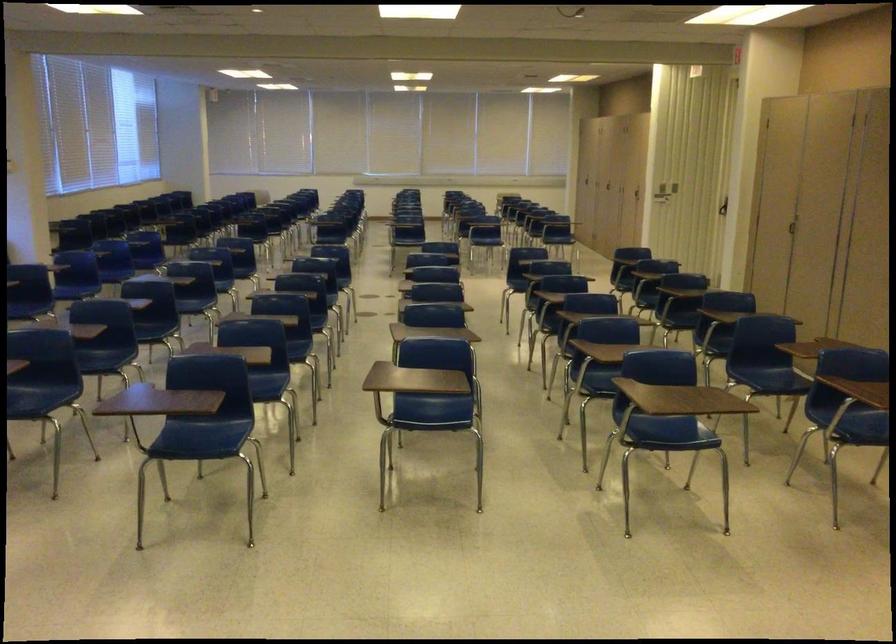
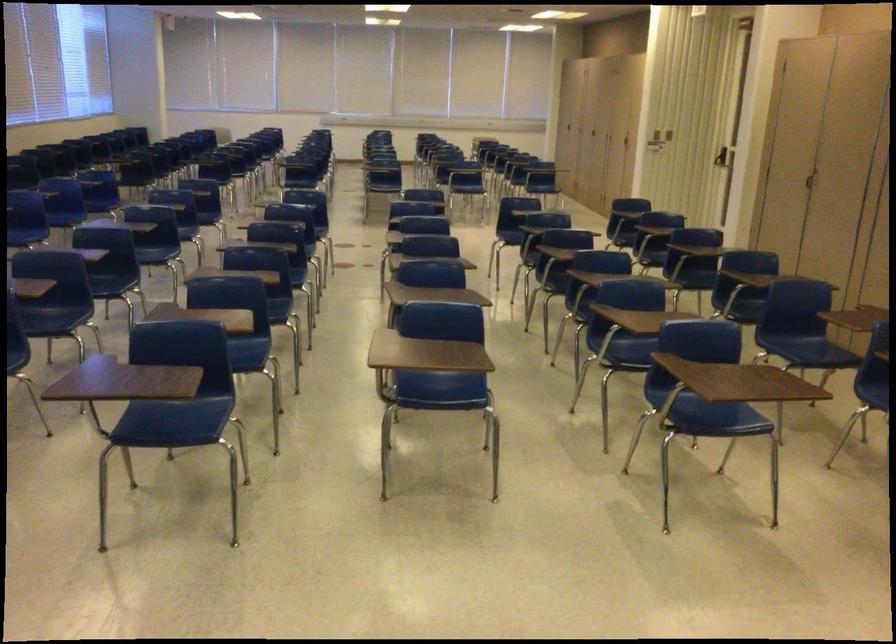
The images are taken continuously from a first-person perspective. In which direction are you moving?

The cameraman moved toward left, forward.